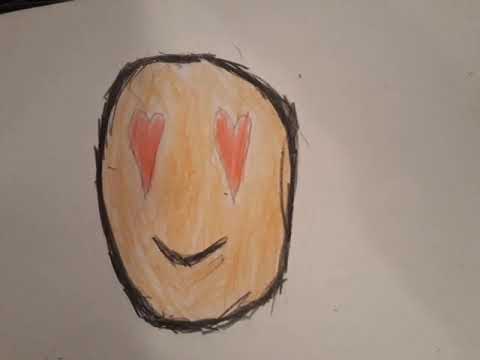
Locate an element on the screen. The image size is (480, 360). 1 piece of paper is located at coordinates (69, 319).